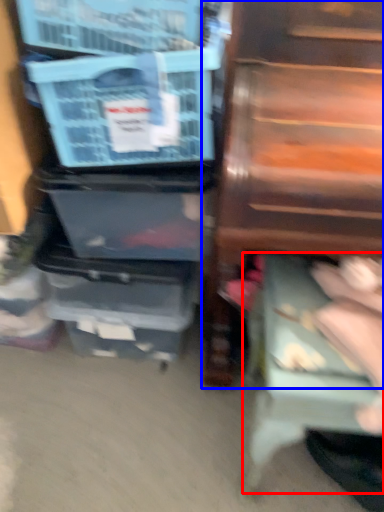
Question: Which object is closer to the camera taking this photo, step stool (highlighted by a red box) or furniture (highlighted by a blue box)?

Choices:
 (A) step stool
 (B) furniture

Answer: (B)